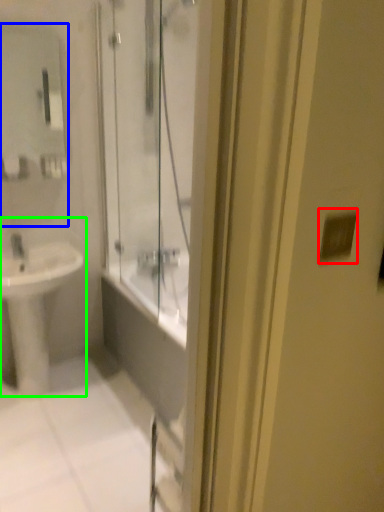
Question: Considering the real-world distances, which object is closest to light switch (highlighted by a red box)? mirror (highlighted by a blue box) or sink (highlighted by a green box).

Choices:
 (A) mirror
 (B) sink

Answer: (B)